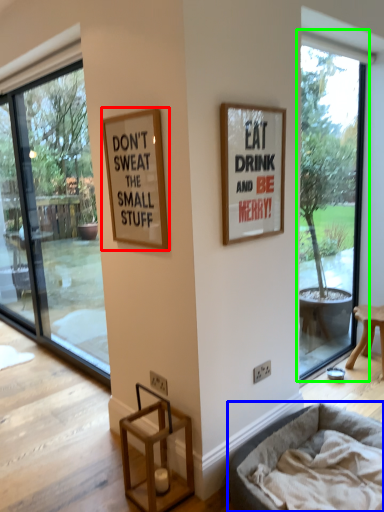
Question: Considering the real-world distances, which object is farthest from picture frame (highlighted by a red box)? dog bed (highlighted by a blue box) or window (highlighted by a green box)?

Choices:
 (A) dog bed
 (B) window

Answer: (B)